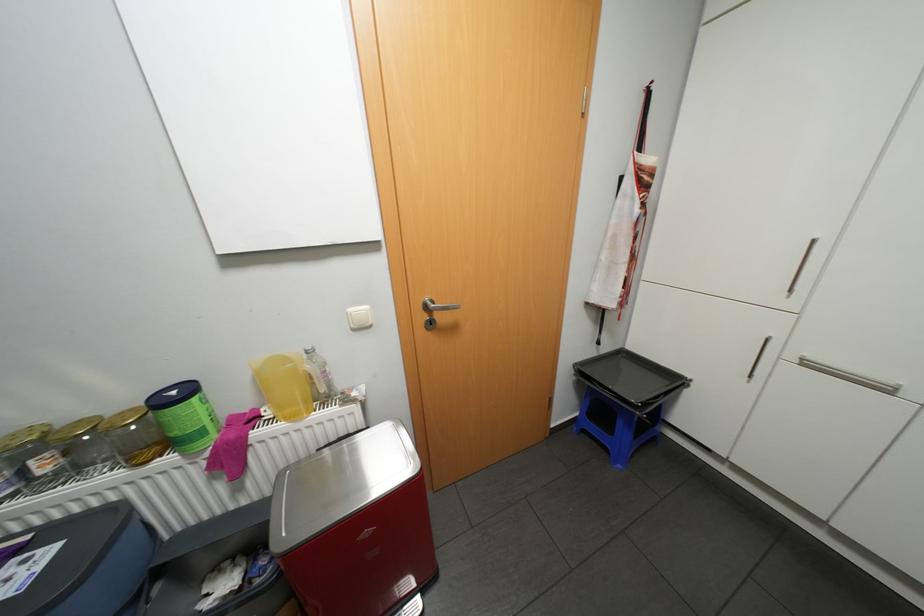
Where is `metal door handle`? This screenshot has width=924, height=616. metal door handle is located at coordinates (438, 305).